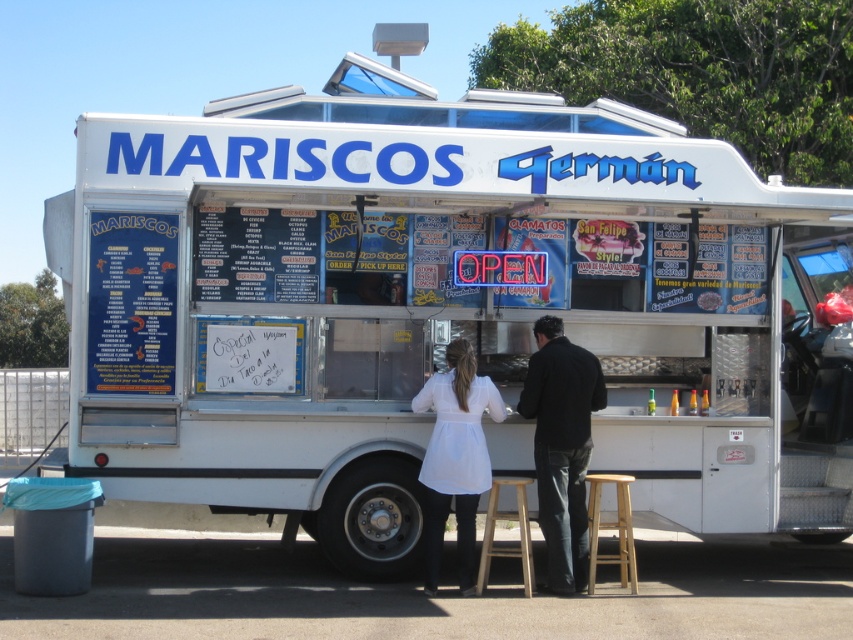
Is white fabric coat at center bigger than light brown wooden stool at lower center?

Yes.

Is white fabric coat at center wider than light brown wooden stool at lower center?

Correct, the width of white fabric coat at center exceeds that of light brown wooden stool at lower center.

Image resolution: width=853 pixels, height=640 pixels. Find the location of `white fabric coat at center`. white fabric coat at center is located at coordinates (561, 445).

Identify the location of white fabric coat at center. (561, 445).

Does black matte jacket at center have a lesser height compared to wooden stool at center?

In fact, black matte jacket at center may be taller than wooden stool at center.

Which is in front, point (561, 557) or point (486, 531)?

Point (486, 531) is more forward.

The width and height of the screenshot is (853, 640). What are the coordinates of `black matte jacket at center` in the screenshot? It's located at (561, 445).

Does white fabric apron at center have a greater height compared to wooden stool at center?

Correct, white fabric apron at center is much taller as wooden stool at center.

Is white fabric apron at center shorter than wooden stool at center?

No, white fabric apron at center is not shorter than wooden stool at center.

This screenshot has width=853, height=640. Find the location of `white fabric apron at center`. white fabric apron at center is located at coordinates (456, 458).